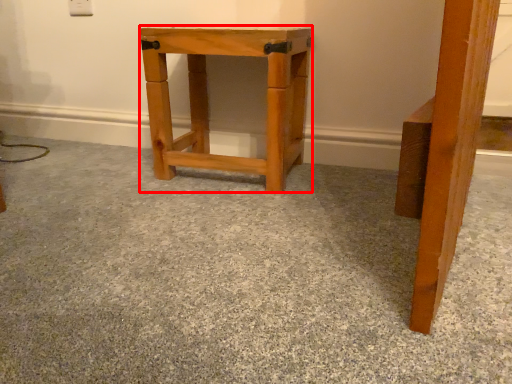
Question: Observing the image, what is the correct spatial positioning of stool (annotated by the red box) in reference to concrete?

Choices:
 (A) right
 (B) left

Answer: (A)